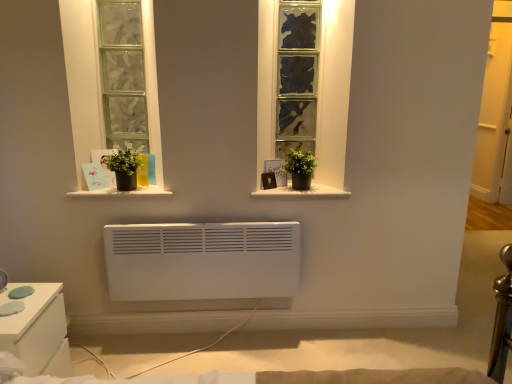
Question: Looking at their shapes, would you say green matte plant pot at left, which appears as the second houseplant when viewed from the right, is wider or thinner than textured glass window at center?

Choices:
 (A) thin
 (B) wide

Answer: (A)

Question: Considering their positions, is green matte plant pot at left, which appears as the second houseplant when viewed from the right, located in front of or behind textured glass window at center?

Choices:
 (A) front
 (B) behind

Answer: (A)

Question: Which object is positioned closest to the matte black pot at center, which is counted as the 1th window sill, starting from the left?

Choices:
 (A) green matte plant pot at left, which appears as the second houseplant when viewed from the right
 (B) white glossy nightstand at lower left
 (C) textured glass window at center
 (D) green matte plant pot at center, placed as the second houseplant when sorted from left to right
 (E) white matte window sill at center, placed as the 2th window sill when sorted from left to right

Answer: (A)

Question: Which object is the closest to the white glossy nightstand at lower left?

Choices:
 (A) green matte plant pot at center, placed as the second houseplant when sorted from left to right
 (B) matte black pot at center, acting as the 2th window sill starting from the right
 (C) green matte plant pot at left, which appears as the second houseplant when viewed from the right
 (D) textured glass window at center
 (E) white matte window sill at center, which is counted as the 1th window sill, starting from the right

Answer: (B)